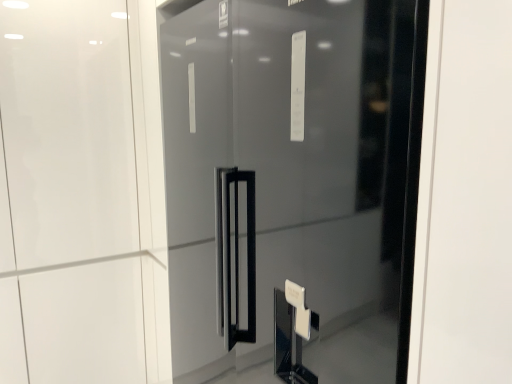
The width and height of the screenshot is (512, 384). What are the coordinates of `glossy metallic refrigerator at center` in the screenshot? It's located at (279, 168).

Image resolution: width=512 pixels, height=384 pixels. What do you see at coordinates (279, 168) in the screenshot?
I see `glossy metallic refrigerator at center` at bounding box center [279, 168].

Find the location of a particular element. glossy metallic refrigerator at center is located at coordinates (279, 168).